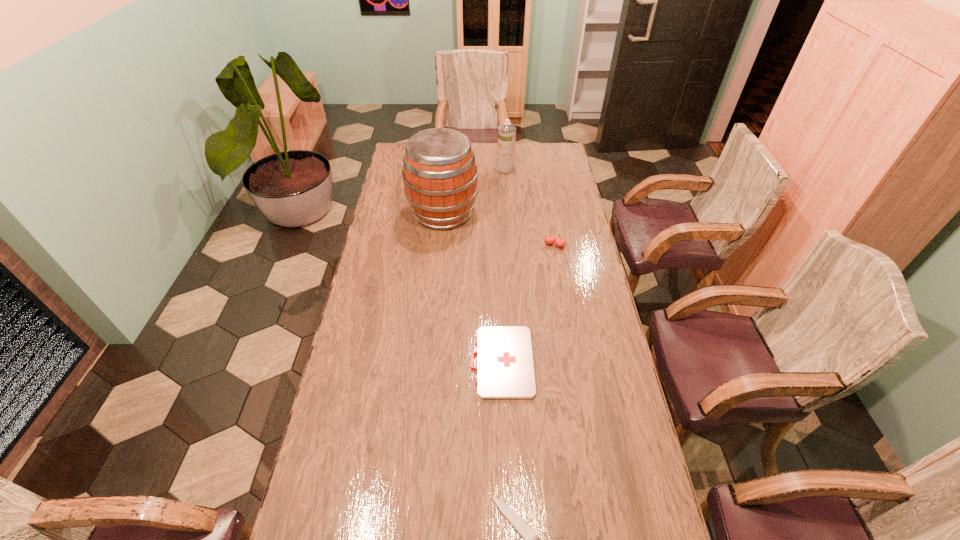
What are the coordinates of `empty space that is in between the first-aid kit and the rightmost object` in the screenshot? It's located at (528, 303).

In order to click on unoccupied position between the cider and the rightmost object in this screenshot , I will do `click(498, 229)`.

The width and height of the screenshot is (960, 540). I want to click on unoccupied position between the third nearest object and the fourth farthest object, so click(528, 303).

What are the coordinates of `free space between the second shortest object and the aerosol can` in the screenshot? It's located at coord(503,265).

Identify which object is located as the third nearest to the second nearest object. Please provide its 2D coordinates. Your answer should be formatted as a tuple, i.e. [(x, y)], where the tuple contains the x and y coordinates of a point satisfying the conditions above.

[(440, 175)]

Locate which object is the third closest to the cherry. Please provide its 2D coordinates. Your answer should be formatted as a tuple, i.e. [(x, y)], where the tuple contains the x and y coordinates of a point satisfying the conditions above.

[(506, 141)]

Find the location of a particular element. This screenshot has height=540, width=960. vacant region that satisfies the following two spatial constraints: 1. on the front side of the aerosol can; 2. on handle side the second shortest object is located at coordinates (519, 362).